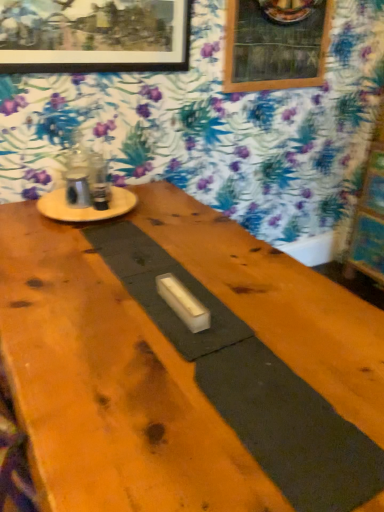
Question: Is wooden round table at upper left shorter than wooden picture frame at upper center, positioned as the first picture frame in back-to-front order?

Choices:
 (A) yes
 (B) no

Answer: (A)

Question: Does wooden round table at upper left appear on the right side of wooden picture frame at upper center, positioned as the 2th picture frame in left-to-right order?

Choices:
 (A) no
 (B) yes

Answer: (A)

Question: Is wooden round table at upper left at the left side of wooden picture frame at upper center, positioned as the 2th picture frame in left-to-right order?

Choices:
 (A) no
 (B) yes

Answer: (B)

Question: Does wooden round table at upper left lie in front of wooden picture frame at upper center, the 2th picture frame positioned from the front?

Choices:
 (A) no
 (B) yes

Answer: (B)

Question: From the image's perspective, is wooden round table at upper left under wooden picture frame at upper center, positioned as the first picture frame in back-to-front order?

Choices:
 (A) no
 (B) yes

Answer: (B)

Question: Is wooden round table at upper left in contact with wooden picture frame at upper center, positioned as the first picture frame in back-to-front order?

Choices:
 (A) yes
 (B) no

Answer: (B)

Question: Is wooden bulletin board at right thinner than wooden round table at upper left?

Choices:
 (A) no
 (B) yes

Answer: (A)

Question: From a real-world perspective, is wooden bulletin board at right on top of wooden round table at upper left?

Choices:
 (A) no
 (B) yes

Answer: (A)

Question: Would you consider wooden bulletin board at right to be distant from wooden round table at upper left?

Choices:
 (A) no
 (B) yes

Answer: (B)

Question: Is wooden bulletin board at right to the left of wooden round table at upper left from the viewer's perspective?

Choices:
 (A) no
 (B) yes

Answer: (A)

Question: Is wooden bulletin board at right closer to camera compared to wooden round table at upper left?

Choices:
 (A) no
 (B) yes

Answer: (A)

Question: Considering the relative sizes of wooden bulletin board at right and wooden round table at upper left in the image provided, is wooden bulletin board at right bigger than wooden round table at upper left?

Choices:
 (A) no
 (B) yes

Answer: (B)

Question: From a real-world perspective, is smooth wood table at center positioned under wooden bulletin board at right based on gravity?

Choices:
 (A) yes
 (B) no

Answer: (B)